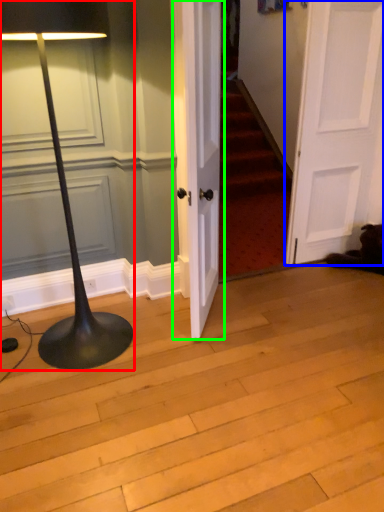
Question: Which object is positioned closest to lamp (highlighted by a red box)? Select from door (highlighted by a blue box) and door (highlighted by a green box).

Choices:
 (A) door
 (B) door

Answer: (B)